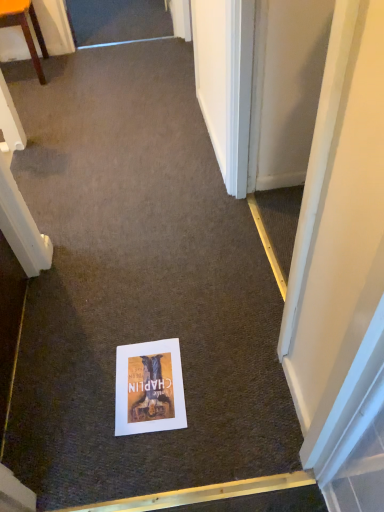
Question: From a real-world perspective, is matte paper poster at center beneath wooden chair at upper left?

Choices:
 (A) yes
 (B) no

Answer: (A)

Question: Are matte paper poster at center and wooden chair at upper left making contact?

Choices:
 (A) yes
 (B) no

Answer: (B)

Question: Can you confirm if matte paper poster at center is shorter than wooden chair at upper left?

Choices:
 (A) yes
 (B) no

Answer: (A)

Question: Considering the relative positions of matte paper poster at center and wooden chair at upper left in the image provided, is matte paper poster at center to the right of wooden chair at upper left from the viewer's perspective?

Choices:
 (A) yes
 (B) no

Answer: (A)

Question: From the image's perspective, is matte paper poster at center under wooden chair at upper left?

Choices:
 (A) no
 (B) yes

Answer: (B)

Question: Is matte paper poster at center outside wooden chair at upper left?

Choices:
 (A) no
 (B) yes

Answer: (B)

Question: Is wooden chair at upper left beside matte paper poster at center?

Choices:
 (A) no
 (B) yes

Answer: (A)

Question: Is wooden chair at upper left positioned before matte paper poster at center?

Choices:
 (A) no
 (B) yes

Answer: (A)

Question: Does wooden chair at upper left have a lesser width compared to matte paper poster at center?

Choices:
 (A) yes
 (B) no

Answer: (B)

Question: From a real-world perspective, is wooden chair at upper left beneath matte paper poster at center?

Choices:
 (A) no
 (B) yes

Answer: (A)

Question: Does wooden chair at upper left have a greater height compared to matte paper poster at center?

Choices:
 (A) no
 (B) yes

Answer: (B)

Question: From the image's perspective, is wooden chair at upper left located beneath matte paper poster at center?

Choices:
 (A) yes
 (B) no

Answer: (B)

Question: Relative to matte paper poster at center, is wooden chair at upper left in front or behind?

Choices:
 (A) behind
 (B) front

Answer: (A)